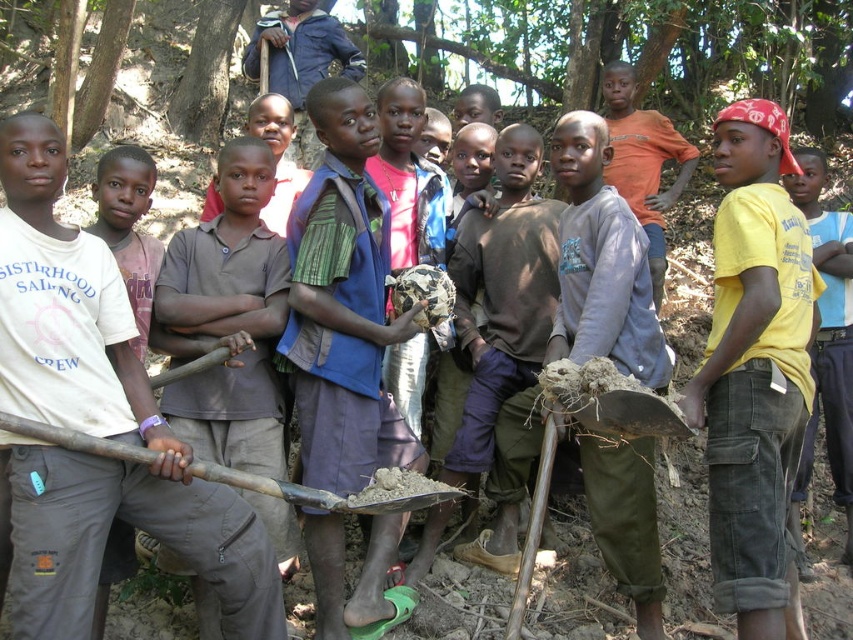
Is orange cotton shirt at center to the right of wooden shovel at center from the viewer's perspective?

Indeed, orange cotton shirt at center is positioned on the right side of wooden shovel at center.

Can you confirm if orange cotton shirt at center is wider than wooden shovel at center?

In fact, orange cotton shirt at center might be narrower than wooden shovel at center.

Who is more forward, (643, 161) or (202, 476)?

Positioned in front is point (202, 476).

I want to click on orange cotton shirt at center, so click(x=643, y=161).

Does point (341, 528) come in front of point (621, 138)?

Yes, point (341, 528) is closer to viewer.

Can you confirm if blue fabric shirt at center is positioned to the left of orange cotton shirt at center?

Correct, you'll find blue fabric shirt at center to the left of orange cotton shirt at center.

Is point (419, 308) less distant than point (643, 173)?

That is True.

You are a GUI agent. You are given a task and a screenshot of the screen. Output one action in this format:
    pyautogui.click(x=<x>, y=<y>)
    Task: Click on the blue fabric shirt at center
    This screenshot has width=853, height=640.
    Given the screenshot: What is the action you would take?
    pyautogui.click(x=343, y=304)

Can you confirm if brown cotton shirt at center is smaller than wooden shovel at center?

Actually, brown cotton shirt at center might be larger than wooden shovel at center.

Who is higher up, brown cotton shirt at center or wooden shovel at center?

Positioned higher is brown cotton shirt at center.

Locate an element on the screen. The width and height of the screenshot is (853, 640). brown cotton shirt at center is located at coordinates (229, 317).